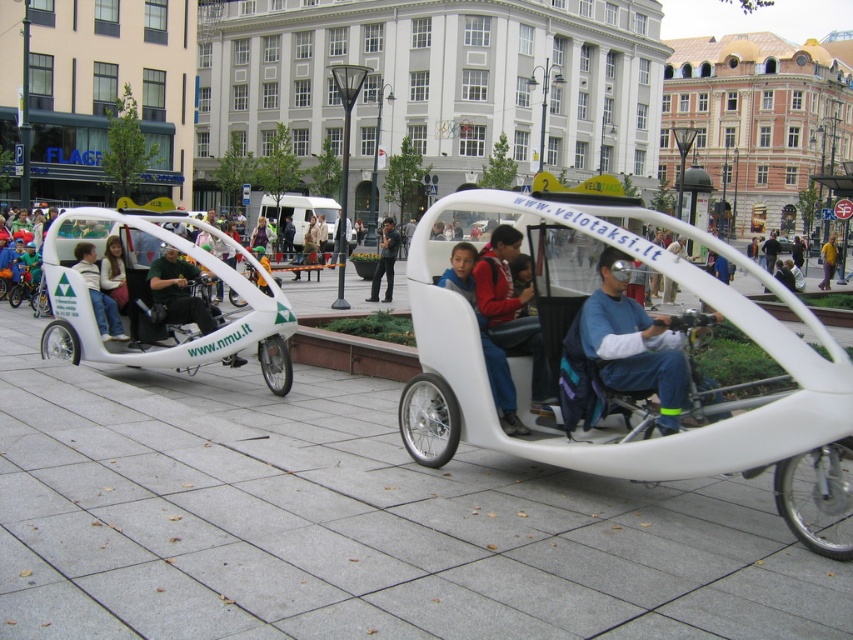
You are a tourist standing in the square and want to take a photo of the white matte pedicab at center and the red sweater at center. Which object should you focus on first if you want to capture both in the same frame without moving the camera?

The white matte pedicab at center is larger in size than the red sweater at center, so you should focus on the white matte pedicab at center first to ensure it fills the frame appropriately before adjusting for the smaller red sweater at center.

You are standing at the square and want to take a photo of the point at coordinates (x=625, y=332). If your camera has a maximum focus range of 5 meters, will you be able to capture the point clearly?

The distance of point (x=625, y=332) from viewer is 5.54 meters, which exceeds the camera maximum focus range of 5 meters. Therefore, you won not be able to capture the point clearly.

Based on the photo, you are a tourist standing in the square and want to take a photo of the white matte pedicab at center and the red sweater at center together in the same frame. Based on their distance, can you fit both in your smartphone camera without moving closer or farther away?

The white matte pedicab at center and the red sweater at center are 26.06 inches apart from each other. Since this distance is within the typical framing capabilities of a smartphone camera, you can likely capture both in the same frame without adjusting your position.